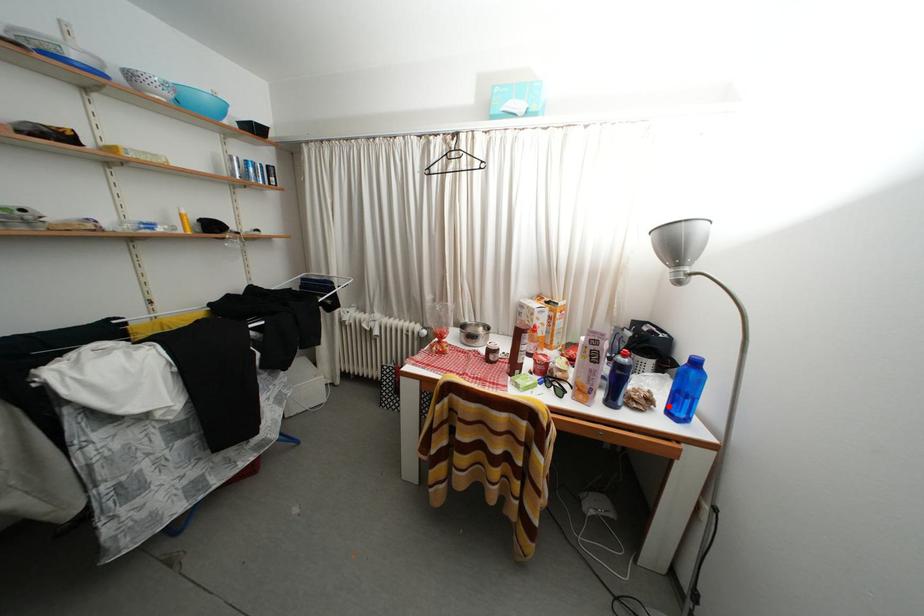
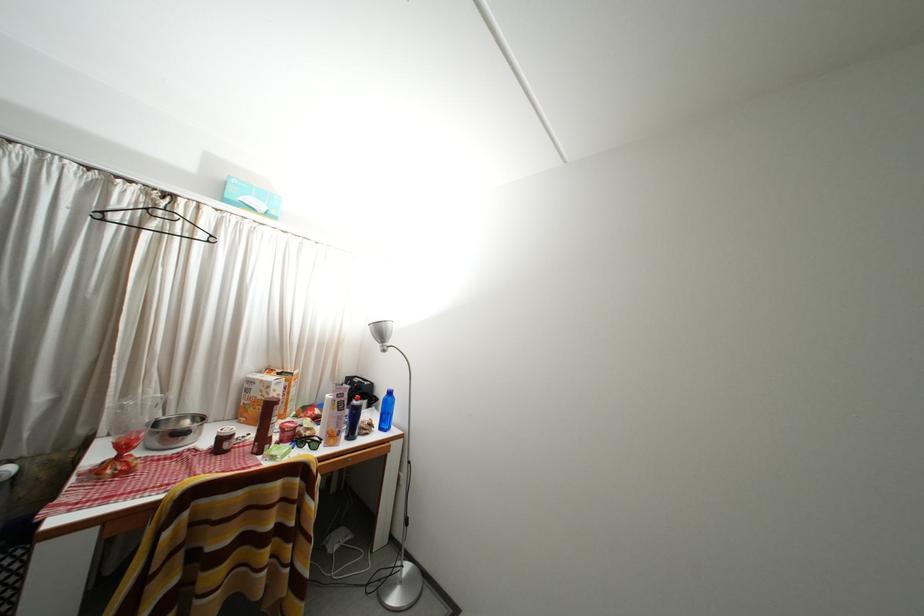
Question: I am providing you with two images of the same scene from different viewpoints. In image1, a red point is highlighted. Considering the same 3D point in image2, which of the following is correct?

Choices:
 (A) It is closer
 (B) It is farther

Answer: (B)